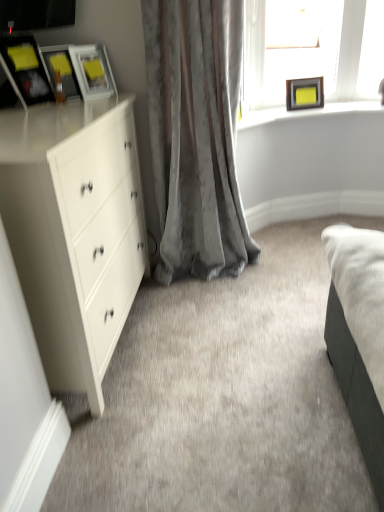
Locate an element on the screen. This screenshot has height=512, width=384. vacant space to the right of matte black picture frame at upper left, acting as the second picture frame starting from the left is located at coordinates (99, 99).